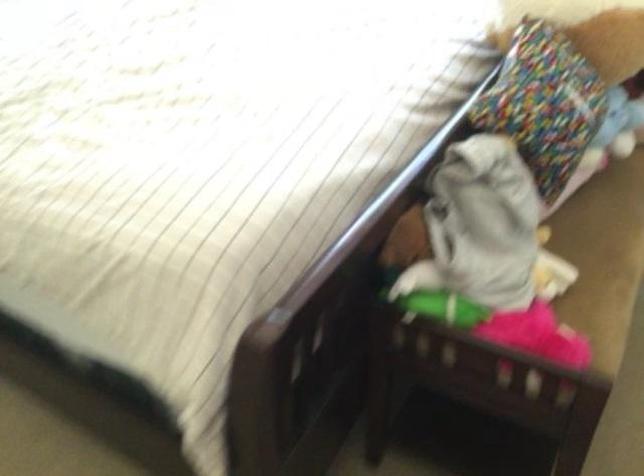
What do you see at coordinates (598, 236) in the screenshot?
I see `the sofa sitting surface` at bounding box center [598, 236].